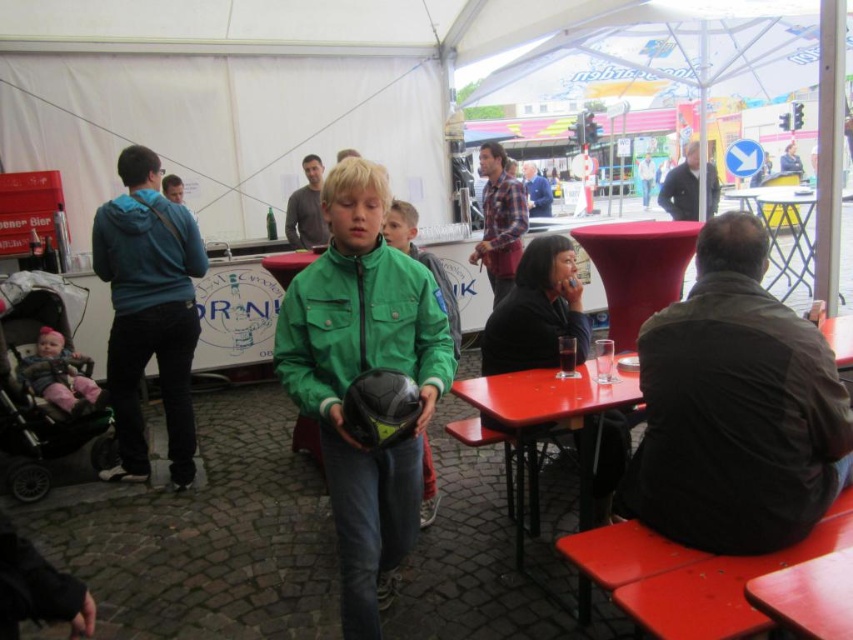
Question: Does pink fabric baby carriage at left have a smaller size compared to blue fabric shirt at center?

Choices:
 (A) no
 (B) yes

Answer: (B)

Question: Which object appears closest to the camera in this image?

Choices:
 (A) blue fleece jacket at left
 (B) matte plastic table at lower right
 (C) green matte jacket at center
 (D) light blue fabric shirt at upper left

Answer: (B)

Question: Which object is closer to the camera taking this photo?

Choices:
 (A) blue fleece jacket at left
 (B) blue fabric shirt at center
 (C) dark brown leather jacket at right
 (D) pink fabric baby carriage at left

Answer: (C)

Question: From the image, what is the correct spatial relationship of dark brown leather jacket at right in relation to blue fleece jacket at left?

Choices:
 (A) right
 (B) left

Answer: (A)

Question: Does matte gray shirt at center have a greater width compared to light blue fabric shirt at upper left?

Choices:
 (A) yes
 (B) no

Answer: (B)

Question: Which object appears closest to the camera in this image?

Choices:
 (A) blue fabric shirt at center
 (B) dark blue jacket at center

Answer: (B)